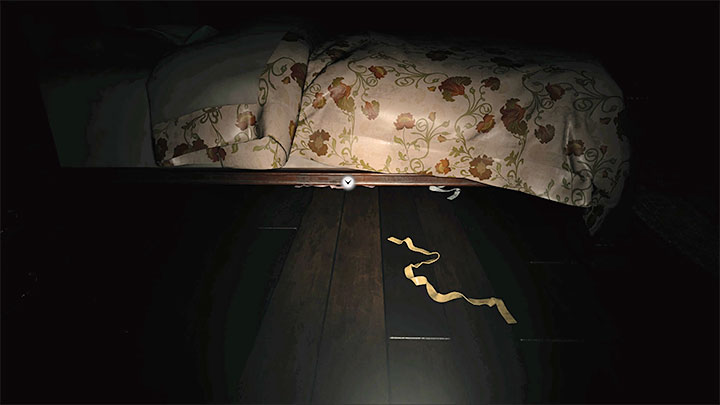
Where is `top of bed`? This screenshot has height=405, width=720. top of bed is located at coordinates (402, 44).